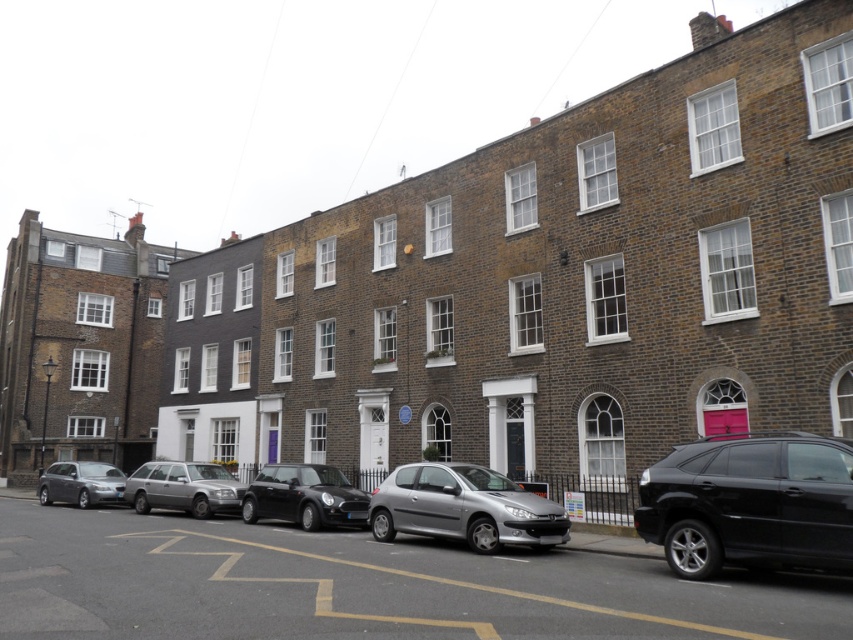
How much distance is there between shiny black suv at right and silver metallic hatchback at center?

The distance of shiny black suv at right from silver metallic hatchback at center is 17.90 feet.

The height and width of the screenshot is (640, 853). What do you see at coordinates (750, 502) in the screenshot?
I see `shiny black suv at right` at bounding box center [750, 502].

Is point (680, 541) positioned behind point (467, 515)?

No.

This screenshot has height=640, width=853. Find the location of `shiny black suv at right`. shiny black suv at right is located at coordinates (750, 502).

Can you confirm if shiny black suv at right is smaller than shiny black car at center?

Yes, shiny black suv at right is smaller than shiny black car at center.

Locate an element on the screen. The image size is (853, 640). shiny black suv at right is located at coordinates (750, 502).

Where is `shiny black suv at right`? This screenshot has height=640, width=853. shiny black suv at right is located at coordinates (750, 502).

Does shiny black suv at right have a larger size compared to silver metallic estate car at center-left?

No.

Which is in front, point (764, 481) or point (177, 499)?

Point (764, 481) is more forward.

Find the location of `shiny black suv at right`. shiny black suv at right is located at coordinates (750, 502).